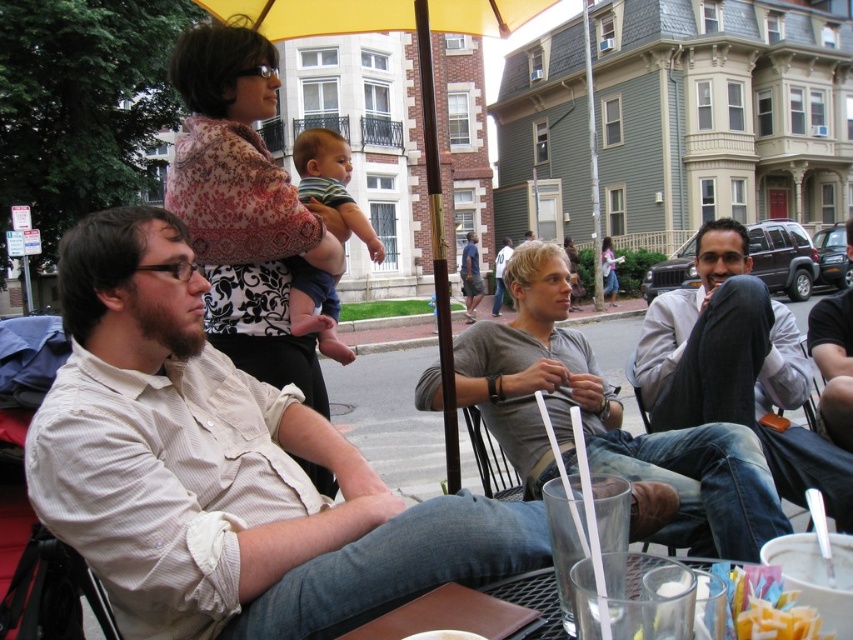
Question: Is light beige shirt at center above light gray sweater at right?

Choices:
 (A) yes
 (B) no

Answer: (B)

Question: Which of the following is the closest to the observer?

Choices:
 (A) (503, 435)
 (B) (662, 420)

Answer: (B)

Question: Among these points, which one is farthest from the camera?

Choices:
 (A) (450, 509)
 (B) (277, 192)
 (C) (421, 637)
 (D) (786, 348)

Answer: (B)

Question: Does gray cotton shirt at center have a smaller size compared to floral-patterned blouse at upper left?

Choices:
 (A) no
 (B) yes

Answer: (B)

Question: Among these objects, which one is farthest from the camera?

Choices:
 (A) clear glass at lower center
 (B) yellow fabric umbrella at upper center

Answer: (B)

Question: Does light beige shirt at center appear on the left side of clear glass at lower center?

Choices:
 (A) yes
 (B) no

Answer: (A)